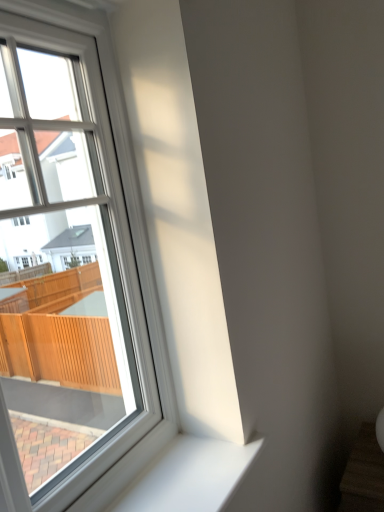
In order to click on white plastic window at upper left in this screenshot , I will do `click(127, 266)`.

The height and width of the screenshot is (512, 384). Describe the element at coordinates (127, 266) in the screenshot. I see `white plastic window at upper left` at that location.

This screenshot has height=512, width=384. What do you see at coordinates (189, 476) in the screenshot?
I see `white smooth window sill at lower left` at bounding box center [189, 476].

Locate an element on the screen. This screenshot has height=512, width=384. white smooth window sill at lower left is located at coordinates (189, 476).

What is the approximate width of white smooth window sill at lower left?

white smooth window sill at lower left is 10.29 inches wide.

At what (x,y) coordinates should I click in order to perform the action: click on white plastic window at upper left. Please return your answer as a coordinate pair (x, y). Looking at the image, I should click on (127, 266).

Based on their positions, is white smooth window sill at lower left located to the left or right of white plastic window at upper left?

Clearly, white smooth window sill at lower left is on the right of white plastic window at upper left in the image.

Considering their positions, is white smooth window sill at lower left located in front of or behind white plastic window at upper left?

white smooth window sill at lower left is positioned farther from the viewer than white plastic window at upper left.

Which is in front, point (239, 470) or point (129, 216)?

The point (239, 470) is closer to the camera.

From the image's perspective, would you say white smooth window sill at lower left is positioned over white plastic window at upper left?

No, from the image's perspective, white smooth window sill at lower left is not above white plastic window at upper left.

From a real-world perspective, is white smooth window sill at lower left over white plastic window at upper left?

No, from a real-world perspective, white smooth window sill at lower left is not above white plastic window at upper left.

Which object is thinner, white smooth window sill at lower left or white plastic window at upper left?

Thinner between the two is white plastic window at upper left.

Can you confirm if white smooth window sill at lower left is shorter than white plastic window at upper left?

Correct, white smooth window sill at lower left is not as tall as white plastic window at upper left.

Is white smooth window sill at lower left smaller than white plastic window at upper left?

Yes, white smooth window sill at lower left is smaller than white plastic window at upper left.

Is white smooth window sill at lower left positioned beyond the bounds of white plastic window at upper left?

Yes.

Is white smooth window sill at lower left in contact with white plastic window at upper left?

There is a gap between white smooth window sill at lower left and white plastic window at upper left.

Is white smooth window sill at lower left oriented towards white plastic window at upper left?

No, white smooth window sill at lower left is not turned towards white plastic window at upper left.

At what (x,y) coordinates should I click in order to perform the action: click on window sill beneath the white plastic window at upper left (from a real-world perspective). Please return your answer as a coordinate pair (x, y). Looking at the image, I should click on (189, 476).

Is white plastic window at upper left at the left side of white smooth window sill at lower left?

Yes, white plastic window at upper left is to the left of white smooth window sill at lower left.

Is white plastic window at upper left behind white smooth window sill at lower left?

No.

Is point (106, 467) in front of point (211, 501)?

That is False.

From the image's perspective, who appears lower, white plastic window at upper left or white smooth window sill at lower left?

white smooth window sill at lower left, from the image's perspective.

From a real-world perspective, which object stands above the other?

white plastic window at upper left is physically above.

Which of these two, white plastic window at upper left or white smooth window sill at lower left, is wider?

Answer: With larger width is white smooth window sill at lower left.

In terms of height, does white plastic window at upper left look taller or shorter compared to white smooth window sill at lower left?

white plastic window at upper left is taller than white smooth window sill at lower left.

Is white plastic window at upper left smaller than white smooth window sill at lower left?

No, white plastic window at upper left is not smaller than white smooth window sill at lower left.

Looking at this image, is white plastic window at upper left surrounding white smooth window sill at lower left?

No, white smooth window sill at lower left is not a part of white plastic window at upper left.

Is white plastic window at upper left in contact with white smooth window sill at lower left?

No, white plastic window at upper left is not with white smooth window sill at lower left.

Is white plastic window at upper left looking in the opposite direction of white smooth window sill at lower left?

No, white smooth window sill at lower left is not at the back of white plastic window at upper left.

You are a GUI agent. You are given a task and a screenshot of the screen. Output one action in this format:
    pyautogui.click(x=<x>, y=<y>)
    Task: Click on the window on the left of the white smooth window sill at lower left
    The image size is (384, 512).
    Given the screenshot: What is the action you would take?
    pyautogui.click(x=127, y=266)

Find the location of a particular element. The image size is (384, 512). window sill below the white plastic window at upper left (from the image's perspective) is located at coordinates (189, 476).

This screenshot has width=384, height=512. Identify the location of window on the left side of white smooth window sill at lower left. (127, 266).